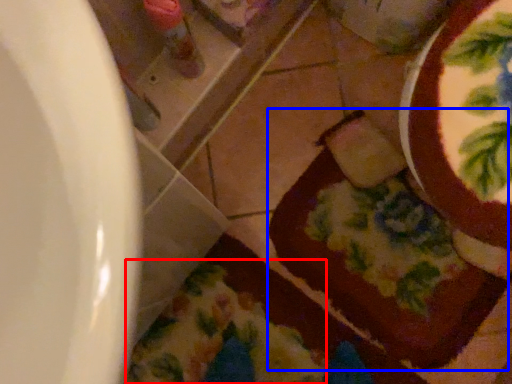
Question: Which point is closer to the camera, blanket (highlighted by a red box) or chocolate cake (highlighted by a blue box)?

Choices:
 (A) blanket
 (B) chocolate cake

Answer: (A)